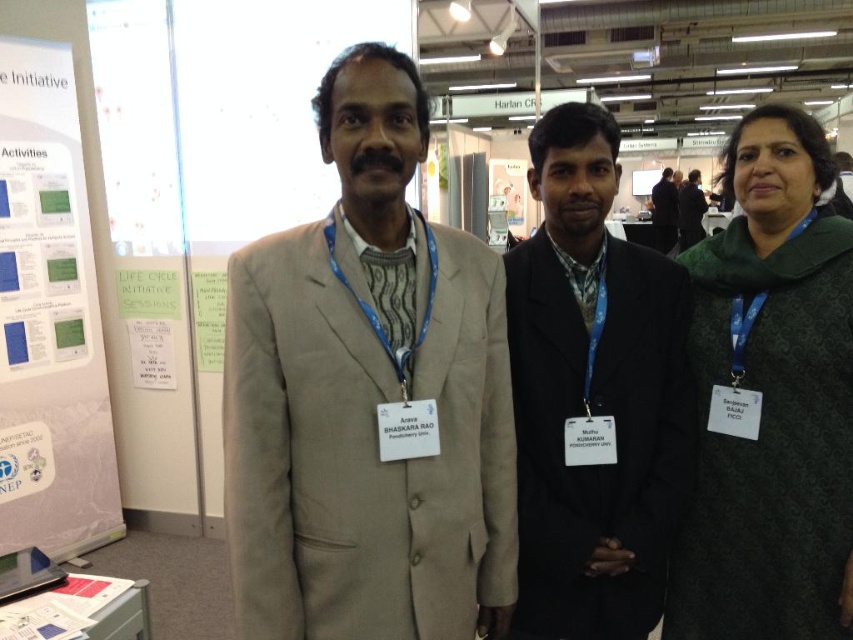
Question: Is black matte suit at center above dark gray suit at center?

Choices:
 (A) yes
 (B) no

Answer: (B)

Question: Can you confirm if green textured shawl at right is smaller than white paper at left?

Choices:
 (A) no
 (B) yes

Answer: (B)

Question: Which of these objects is positioned farthest from the green textured shawl at right?

Choices:
 (A) beige woolen suit at center
 (B) dark gray suit at center
 (C) white paper at left
 (D) black matte suit at center

Answer: (B)

Question: Which object is positioned farthest from the white paper at left?

Choices:
 (A) green textured shawl at right
 (B) beige woolen suit at center
 (C) dark gray suit at center

Answer: (C)

Question: Is black matte suit at center positioned at the back of white paper at left?

Choices:
 (A) yes
 (B) no

Answer: (B)

Question: Which point is farther to the camera?

Choices:
 (A) (637, 260)
 (B) (770, 348)
 (C) (57, 358)

Answer: (C)